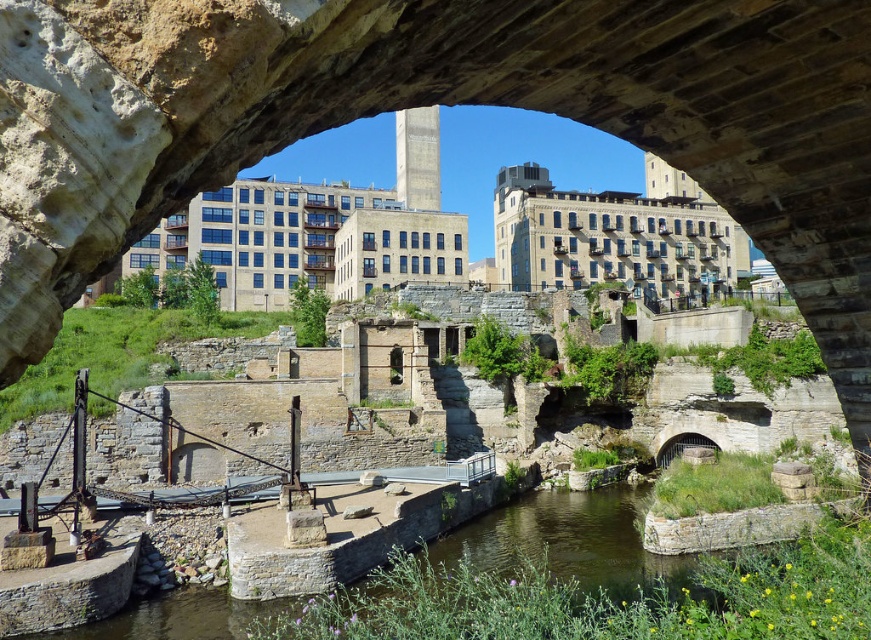
You are a photographer planning to capture the stone arch bridge at center and the clear water at center in a single shot. Based on their relative heights, which object will appear larger in the photo?

The stone arch bridge at center will appear larger in the photo because it is taller than the clear water at center.

You are standing at the point marked by the coordinates (431,104) in the image, which corresponds to the stone arch bridge at center. Looking towards the background, what type of structures do you see?

In the background, you see modern multi story buildings rising against a clear blue sky.